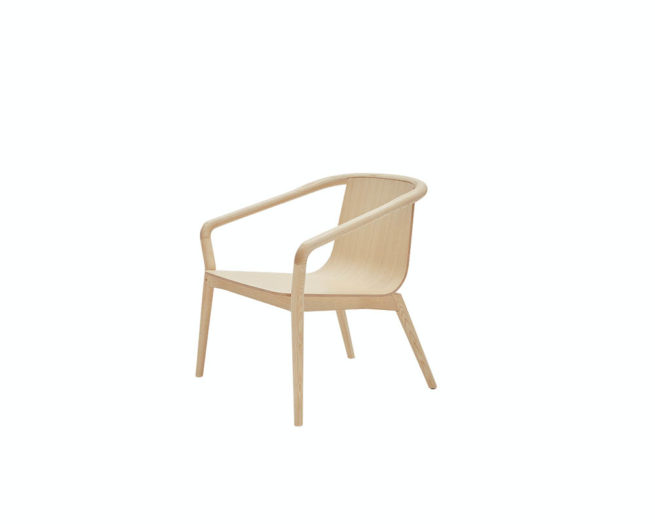
Find the location of `empty space behind chair`. empty space behind chair is located at coordinates (470, 272).